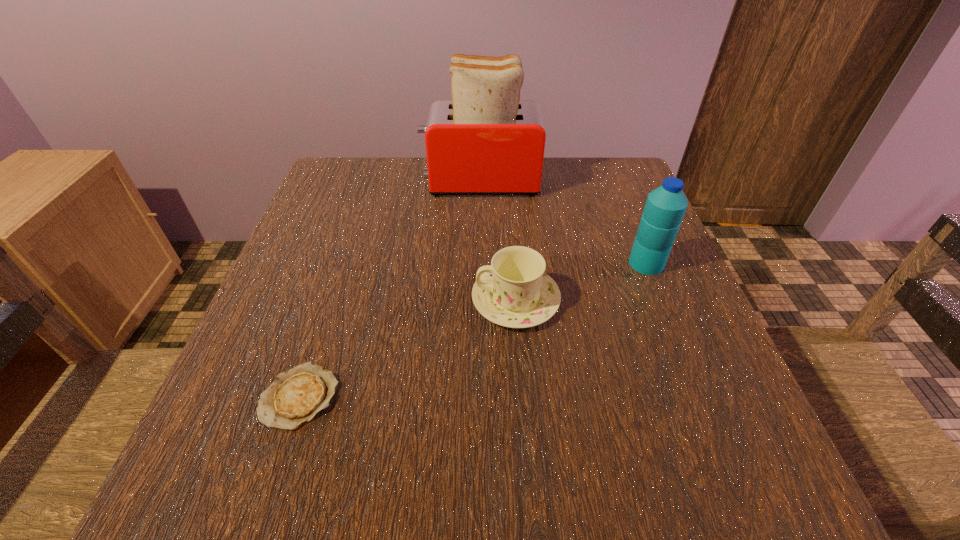
In order to click on the tallest object in this screenshot , I will do `click(485, 141)`.

Identify the location of toaster. [485, 141].

Where is `water bottle`? water bottle is located at coordinates (665, 207).

Where is `the second tallest object`? This screenshot has height=540, width=960. the second tallest object is located at coordinates (665, 207).

Where is `chinaware`? The width and height of the screenshot is (960, 540). chinaware is located at coordinates (514, 291).

Image resolution: width=960 pixels, height=540 pixels. Find the location of `the leftmost object`. the leftmost object is located at coordinates (296, 396).

Locate an element on the screen. the nearest object is located at coordinates (296, 396).

Find the location of a particular element. free spot located 0.160m on the front-facing side of the tallest object is located at coordinates (360, 182).

The image size is (960, 540). In order to click on free region located on the front-facing side of the tallest object in this screenshot , I will do `click(403, 182)`.

You are a GUI agent. You are given a task and a screenshot of the screen. Output one action in this format:
    pyautogui.click(x=<x>, y=<y>)
    Task: Click on the free space located 0.140m on the front-facing side of the tallest object
    
    Given the screenshot: What is the action you would take?
    pyautogui.click(x=368, y=182)